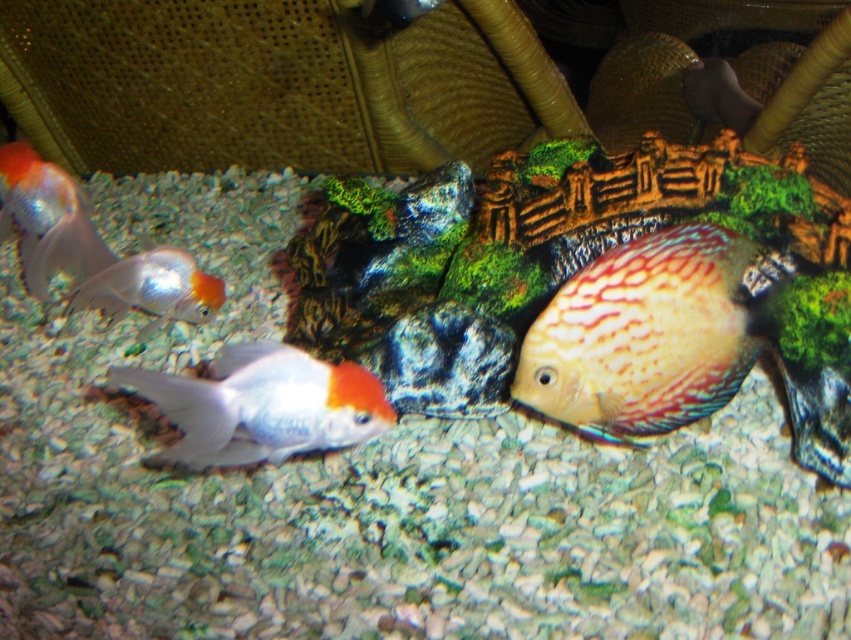
Can you confirm if white glossy goldfish at center is thinner than shiny orange and white fish at left?

Yes, white glossy goldfish at center is thinner than shiny orange and white fish at left.

Can you confirm if white glossy goldfish at center is shorter than shiny orange and white fish at left?

Indeed, white glossy goldfish at center has a lesser height compared to shiny orange and white fish at left.

Who is more distant from viewer, (340, 422) or (184, 304)?

The point (184, 304) is more distant.

The height and width of the screenshot is (640, 851). I want to click on white glossy goldfish at center, so click(x=261, y=404).

Which is more to the right, multicolored textured discus at center or white glossy goldfish at center?

multicolored textured discus at center is more to the right.

Is multicolored textured discus at center to the left of white glossy goldfish at center from the viewer's perspective?

No, multicolored textured discus at center is not to the left of white glossy goldfish at center.

Measure the distance between point (625, 369) and camera.

They are 1.08 meters apart.

Image resolution: width=851 pixels, height=640 pixels. I want to click on multicolored textured discus at center, so click(647, 333).

How much distance is there between multicolored textured discus at center and shiny metallic goldfish at left?

The distance of multicolored textured discus at center from shiny metallic goldfish at left is 1.10 meters.

At what (x,y) coordinates should I click in order to perform the action: click on multicolored textured discus at center. Please return your answer as a coordinate pair (x, y). The height and width of the screenshot is (640, 851). Looking at the image, I should click on (647, 333).